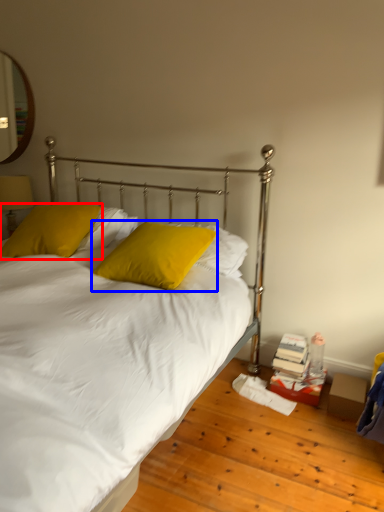
Question: Among these objects, which one is farthest to the camera, pillow (highlighted by a red box) or pillow (highlighted by a blue box)?

Choices:
 (A) pillow
 (B) pillow

Answer: (A)